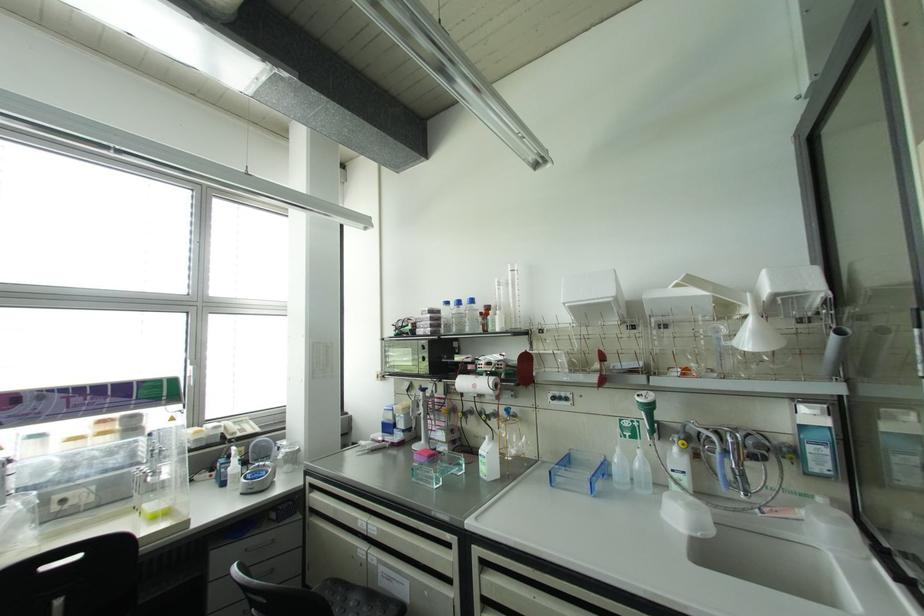
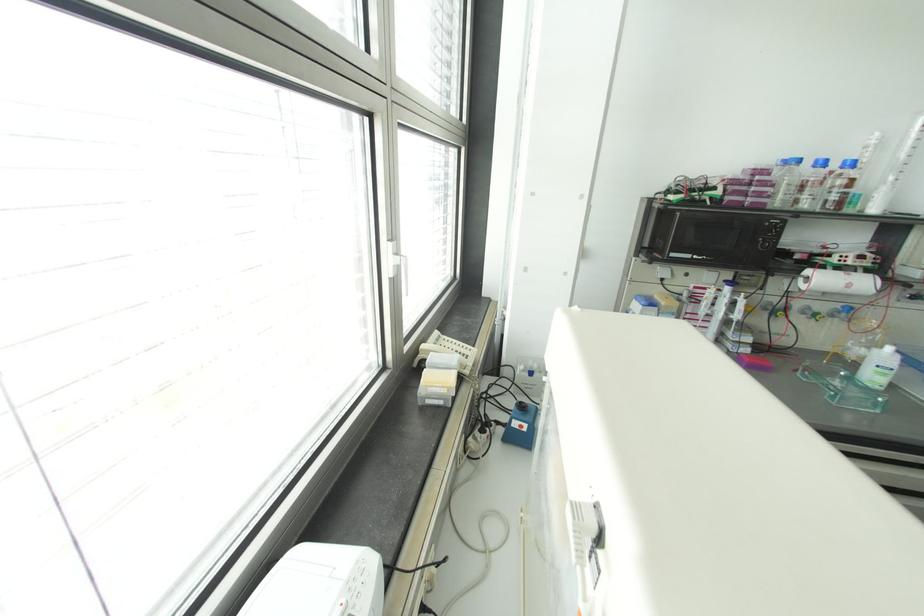
In the second image, find the point that corresponds to [458,302] in the first image.

(822, 163)